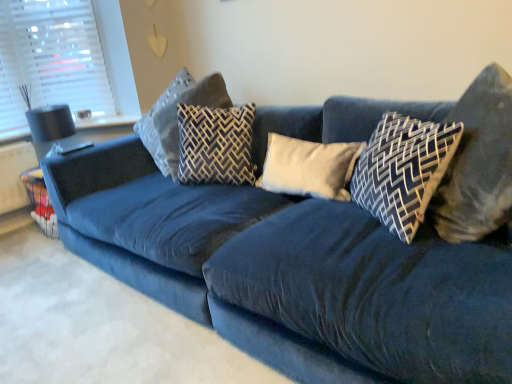
Describe the element at coordinates (478, 163) in the screenshot. I see `dark blue fabric pillow at upper right, positioned as the fifth pillow in left-to-right order` at that location.

Measure the distance between white soft cushion at center, which is the third pillow from right to left, and camera.

white soft cushion at center, which is the third pillow from right to left, is 1.68 meters away from camera.

The width and height of the screenshot is (512, 384). Describe the element at coordinates (216, 145) in the screenshot. I see `patterned fabric pillow at center, the fourth pillow viewed from the right` at that location.

Locate an element on the screen. dark blue fabric pillow at center, which ranks as the 2th pillow in right-to-left order is located at coordinates (403, 170).

Is dark blue fabric pillow at center, which ranks as the 2th pillow in right-to-left order, at the back of dark gray fabric pillow at center, acting as the 5th pillow starting from the right?

No, dark gray fabric pillow at center, acting as the 5th pillow starting from the right,'s orientation is not away from dark blue fabric pillow at center, which ranks as the 2th pillow in right-to-left order.

From the image's perspective, is dark gray fabric pillow at center, acting as the 5th pillow starting from the right, beneath dark blue fabric pillow at center, the 4th pillow from the left?

Actually, dark gray fabric pillow at center, acting as the 5th pillow starting from the right, appears above dark blue fabric pillow at center, the 4th pillow from the left, in the image.

Considering the points (206, 89) and (411, 134), which point is in front, point (206, 89) or point (411, 134)?

The point (411, 134) is in front.

Does dark gray fabric pillow at center, which is the first pillow from left to right, touch dark blue fabric pillow at center, the 4th pillow from the left?

dark gray fabric pillow at center, which is the first pillow from left to right, and dark blue fabric pillow at center, the 4th pillow from the left, are not in contact.

Which is more to the left, dark blue fabric pillow at center, the 4th pillow from the left, or dark blue fabric pillow at upper right, which is the first pillow from right to left?

dark blue fabric pillow at center, the 4th pillow from the left, is more to the left.

Is dark blue fabric pillow at center, the 4th pillow from the left, behind dark blue fabric pillow at upper right, which is the first pillow from right to left?

Yes, the depth of dark blue fabric pillow at center, the 4th pillow from the left, is greater than that of dark blue fabric pillow at upper right, which is the first pillow from right to left.

From the image's perspective, who appears lower, dark blue fabric pillow at center, which ranks as the 2th pillow in right-to-left order, or dark blue fabric pillow at upper right, positioned as the fifth pillow in left-to-right order?

dark blue fabric pillow at center, which ranks as the 2th pillow in right-to-left order, appears lower in the image.

How different are the orientations of dark blue fabric pillow at center, the 4th pillow from the left, and dark blue fabric pillow at upper right, positioned as the fifth pillow in left-to-right order, in degrees?

dark blue fabric pillow at center, the 4th pillow from the left, and dark blue fabric pillow at upper right, positioned as the fifth pillow in left-to-right order, are facing 0.00186 degrees away from each other.

Does point (191, 104) appear closer or farther from the camera than point (473, 156)?

Clearly, point (191, 104) is more distant from the camera than point (473, 156).

Which object is positioned more to the left, dark gray fabric pillow at center, acting as the 5th pillow starting from the right, or dark blue fabric pillow at upper right, positioned as the fifth pillow in left-to-right order?

dark gray fabric pillow at center, acting as the 5th pillow starting from the right.

Is the surface of dark gray fabric pillow at center, acting as the 5th pillow starting from the right, in direct contact with dark blue fabric pillow at upper right, positioned as the fifth pillow in left-to-right order?

They are not placed beside each other.

From the image's perspective, is dark gray fabric pillow at center, acting as the 5th pillow starting from the right, above dark blue fabric pillow at upper right, positioned as the fifth pillow in left-to-right order?

Yes, from the image's perspective, dark gray fabric pillow at center, acting as the 5th pillow starting from the right, is over dark blue fabric pillow at upper right, positioned as the fifth pillow in left-to-right order.

From a real-world perspective, between patterned fabric pillow at center, marked as the 2th pillow in a left-to-right arrangement, and white soft cushion at center, acting as the 3th pillow starting from the left, who is vertically higher?

Answer: In real-world perspective, patterned fabric pillow at center, marked as the 2th pillow in a left-to-right arrangement, is above.

Which pillow is the 1st one when counting from the back of the white soft cushion at center, which is the third pillow from right to left? Please provide its 2D coordinates.

[(216, 145)]

Is point (234, 108) closer or farther from the camera than point (269, 180)?

Point (234, 108) appears to be farther away from the viewer than point (269, 180).

Is patterned fabric pillow at center, marked as the 2th pillow in a left-to-right arrangement, at the right side of white soft cushion at center, which is the third pillow from right to left?

In fact, patterned fabric pillow at center, marked as the 2th pillow in a left-to-right arrangement, is to the left of white soft cushion at center, which is the third pillow from right to left.

Looking at their sizes, would you say dark gray fabric pillow at center, which is the first pillow from left to right, is wider or thinner than white soft cushion at center, which is the third pillow from right to left?

Clearly, dark gray fabric pillow at center, which is the first pillow from left to right, has more width compared to white soft cushion at center, which is the third pillow from right to left.

Is dark gray fabric pillow at center, which is the first pillow from left to right, taller than white soft cushion at center, acting as the 3th pillow starting from the left?

Indeed, dark gray fabric pillow at center, which is the first pillow from left to right, has a greater height compared to white soft cushion at center, acting as the 3th pillow starting from the left.

Is point (186, 77) positioned in front of point (325, 153)?

No, (186, 77) is further to viewer.

Is dark gray fabric pillow at center, which is the first pillow from left to right, further to the viewer compared to patterned fabric pillow at center, marked as the 2th pillow in a left-to-right arrangement?

Yes, dark gray fabric pillow at center, which is the first pillow from left to right, is further from the camera.

Is dark gray fabric pillow at center, acting as the 5th pillow starting from the right, oriented towards patterned fabric pillow at center, the fourth pillow viewed from the right?

No, dark gray fabric pillow at center, acting as the 5th pillow starting from the right, does not turn towards patterned fabric pillow at center, the fourth pillow viewed from the right.

Is point (190, 100) farther from viewer compared to point (216, 176)?

That is True.

Is white plastic blinds at upper left turned away from patterned fabric pillow at center, the fourth pillow viewed from the right?

No, white plastic blinds at upper left's orientation is not away from patterned fabric pillow at center, the fourth pillow viewed from the right.

Considering the points (48, 74) and (204, 130), which point is in front, point (48, 74) or point (204, 130)?

The point (204, 130) is in front.

Considering the relative sizes of white plastic blinds at upper left and patterned fabric pillow at center, the fourth pillow viewed from the right, in the image provided, is white plastic blinds at upper left shorter than patterned fabric pillow at center, the fourth pillow viewed from the right,?

No, white plastic blinds at upper left is not shorter than patterned fabric pillow at center, the fourth pillow viewed from the right.

This screenshot has height=384, width=512. There is a dark blue fabric pillow at center, the 4th pillow from the left. In order to click on the 3rd pillow above it (from a real-world perspective) in this screenshot , I will do `click(176, 116)`.

Where is `the 2nd pillow directly beneath the dark blue fabric pillow at upper right, which is the first pillow from right to left (from a real-world perspective)`? This screenshot has height=384, width=512. the 2nd pillow directly beneath the dark blue fabric pillow at upper right, which is the first pillow from right to left (from a real-world perspective) is located at coordinates (403, 170).

Looking at the image, which one is located further to white plastic blinds at upper left, patterned fabric pillow at center, the fourth pillow viewed from the right, or dark blue fabric pillow at upper right, which is the first pillow from right to left?

dark blue fabric pillow at upper right, which is the first pillow from right to left.

From the image, which object appears to be nearer to white soft cushion at center, which is the third pillow from right to left, dark blue fabric pillow at upper right, positioned as the fifth pillow in left-to-right order, or patterned fabric pillow at center, marked as the 2th pillow in a left-to-right arrangement?

patterned fabric pillow at center, marked as the 2th pillow in a left-to-right arrangement, is closer to white soft cushion at center, which is the third pillow from right to left.

When comparing their distances from dark gray fabric pillow at center, which is the first pillow from left to right, does dark blue fabric pillow at upper right, positioned as the fifth pillow in left-to-right order, or dark blue fabric pillow at center, which ranks as the 2th pillow in right-to-left order, seem further?

Among the two, dark blue fabric pillow at upper right, positioned as the fifth pillow in left-to-right order, is located further to dark gray fabric pillow at center, which is the first pillow from left to right.

Which object lies nearer to the anchor point white soft cushion at center, which is the third pillow from right to left, dark gray fabric pillow at center, acting as the 5th pillow starting from the right, or white plastic blinds at upper left?

dark gray fabric pillow at center, acting as the 5th pillow starting from the right, is positioned closer to the anchor white soft cushion at center, which is the third pillow from right to left.

Estimate the real-world distances between objects in this image. Which object is further from white soft cushion at center, which is the third pillow from right to left, patterned fabric pillow at center, marked as the 2th pillow in a left-to-right arrangement, or white plastic blinds at upper left?

white plastic blinds at upper left is further to white soft cushion at center, which is the third pillow from right to left.

Looking at the image, which one is located closer to dark blue fabric pillow at upper right, positioned as the fifth pillow in left-to-right order, white plastic blinds at upper left or white soft cushion at center, which is the third pillow from right to left?

Based on the image, white soft cushion at center, which is the third pillow from right to left, appears to be nearer to dark blue fabric pillow at upper right, positioned as the fifth pillow in left-to-right order.

Estimate the real-world distances between objects in this image. Which object is further from dark gray fabric pillow at center, which is the first pillow from left to right, patterned fabric pillow at center, marked as the 2th pillow in a left-to-right arrangement, or dark blue fabric pillow at center, the 4th pillow from the left?

Based on the image, dark blue fabric pillow at center, the 4th pillow from the left, appears to be further to dark gray fabric pillow at center, which is the first pillow from left to right.

When comparing their distances from white soft cushion at center, acting as the 3th pillow starting from the left, does dark blue fabric pillow at center, the 4th pillow from the left, or white plastic blinds at upper left seem further?

white plastic blinds at upper left lies further to white soft cushion at center, acting as the 3th pillow starting from the left, than the other object.

Locate an element on the screen. pillow positioned between dark blue fabric pillow at upper right, positioned as the fifth pillow in left-to-right order, and white soft cushion at center, which is the third pillow from right to left, from near to far is located at coordinates (403, 170).

The width and height of the screenshot is (512, 384). In order to click on pillow situated between patterned fabric pillow at center, marked as the 2th pillow in a left-to-right arrangement, and dark blue fabric pillow at center, which ranks as the 2th pillow in right-to-left order, from left to right in this screenshot , I will do `click(309, 167)`.

This screenshot has height=384, width=512. Identify the location of pillow situated between dark gray fabric pillow at center, which is the first pillow from left to right, and white soft cushion at center, acting as the 3th pillow starting from the left, from left to right. (216, 145).

Where is `pillow between white plastic blinds at upper left and patterned fabric pillow at center, the fourth pillow viewed from the right, in the horizontal direction`? This screenshot has width=512, height=384. pillow between white plastic blinds at upper left and patterned fabric pillow at center, the fourth pillow viewed from the right, in the horizontal direction is located at coordinates (176, 116).